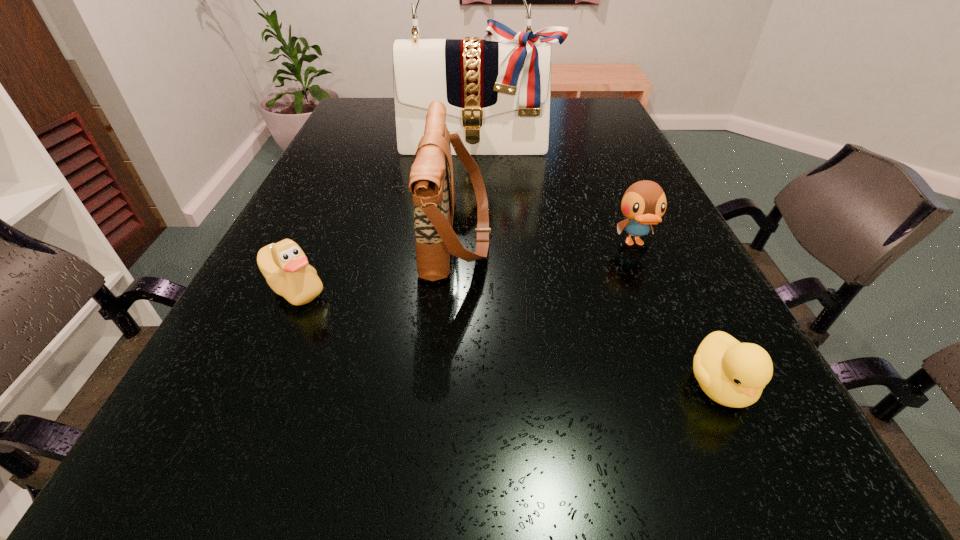
Locate an element on the screen. The image size is (960, 540). blank space located 0.190m at the beak of the leftmost duck is located at coordinates (236, 416).

Locate an element on the screen. The height and width of the screenshot is (540, 960). free space located on the front-facing side of the nearest duck is located at coordinates (780, 511).

Locate an element on the screen. object that is at the left edge is located at coordinates (284, 265).

Locate an element on the screen. vacant region at the left edge is located at coordinates [x=338, y=224].

The width and height of the screenshot is (960, 540). In the image, there is a desktop. Find the location of `vacant region at the right edge`. vacant region at the right edge is located at coordinates (685, 241).

Locate an element on the screen. vacant space at the far right corner of the desktop is located at coordinates (590, 105).

In order to click on vacant area between the farthest duck and the satchel in this screenshot , I will do `click(556, 194)`.

This screenshot has height=540, width=960. Identify the location of free space between the nearest object and the shoulder bag. (588, 309).

This screenshot has width=960, height=540. Identify the location of free spot between the satchel and the shoulder bag. (468, 190).

This screenshot has width=960, height=540. I want to click on vacant area between the nearest duck and the leftmost object, so click(x=507, y=337).